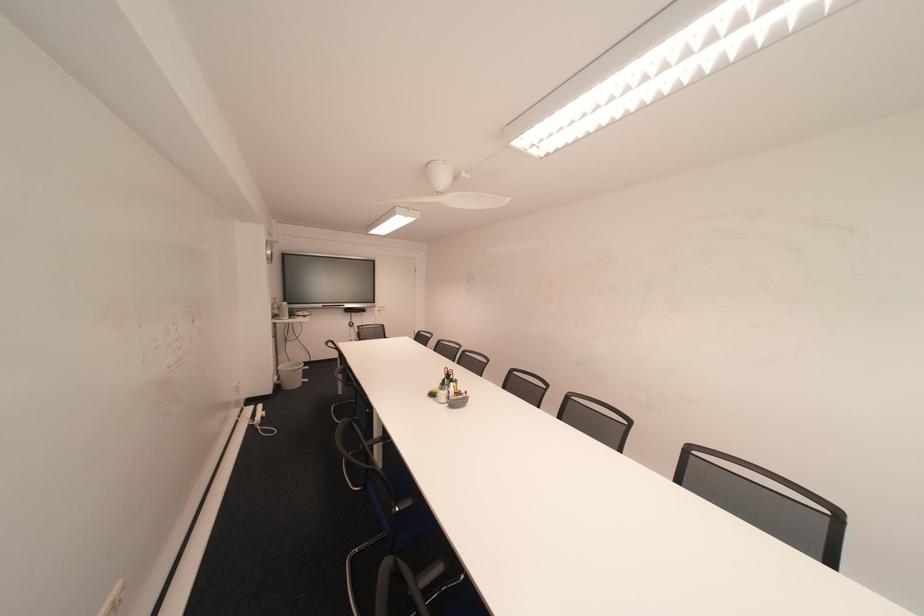
Where is `white trash can`? This screenshot has width=924, height=616. white trash can is located at coordinates (289, 374).